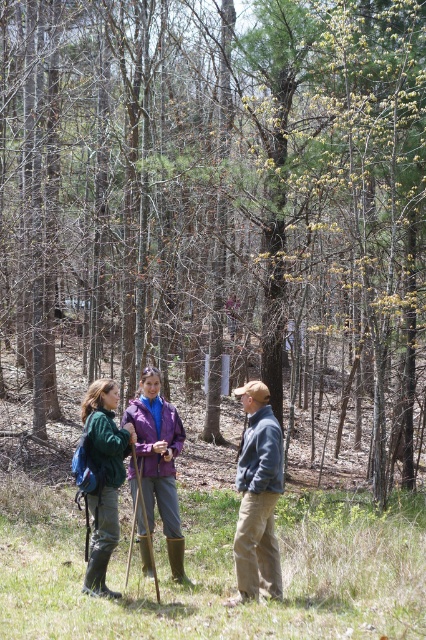
Is purple matte jacket at center thinner than green fuzzy jacket at lower left?

No, purple matte jacket at center is not thinner than green fuzzy jacket at lower left.

Does purple matte jacket at center appear on the right side of green fuzzy jacket at lower left?

Yes, purple matte jacket at center is to the right of green fuzzy jacket at lower left.

Is point (149, 374) closer to camera compared to point (101, 472)?

No, it is behind (101, 472).

Identify the location of purple matte jacket at center. (158, 468).

Does denim jacket at center appear on the right side of purple matte jacket at center?

Yes, denim jacket at center is to the right of purple matte jacket at center.

Is point (258, 499) less distant than point (141, 376)?

Yes, it is in front of point (141, 376).

Locate an element on the screen. denim jacket at center is located at coordinates (258, 497).

Which is behind, point (261, 416) or point (92, 417)?

The point (261, 416) is behind.

Looking at this image, who is more forward, [264,490] or [112,499]?

Point [264,490]

Find the location of `denim jacket at center`. denim jacket at center is located at coordinates (258, 497).

Locate an element on the screen. The width and height of the screenshot is (426, 640). denim jacket at center is located at coordinates (258, 497).